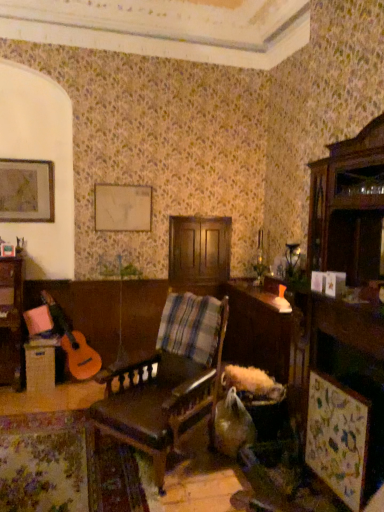
Question: From the image's perspective, relative to leather-like brown chair at center, is wooden table at lower left, which ranks as the second table in right-to-left order, above or below?

Choices:
 (A) above
 (B) below

Answer: (B)

Question: From a real-world perspective, is wooden table at lower left, positioned as the 1th table in left-to-right order, above or below leather-like brown chair at center?

Choices:
 (A) above
 (B) below

Answer: (B)

Question: Which is nearer to the wooden table at center, arranged as the 2th table when viewed from the left?

Choices:
 (A) leather-like brown chair at center
 (B) wooden table at lower left, which ranks as the second table in right-to-left order
 (C) matte wooden picture frame at upper left

Answer: (A)

Question: Estimate the real-world distances between objects in this image. Which object is farther from the wooden table at center, arranged as the 2th table when viewed from the left?

Choices:
 (A) leather-like brown chair at center
 (B) wooden table at lower left, which ranks as the second table in right-to-left order
 (C) matte wooden picture frame at upper left

Answer: (C)